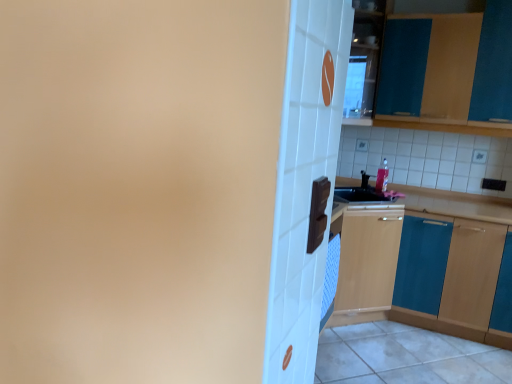
Locate an element on the screen. The image size is (512, 384). teal wood cabinet at right, placed as the first cabinetry when sorted from bottom to top is located at coordinates (420, 272).

Locate an element on the screen. The width and height of the screenshot is (512, 384). teal wood cabinet at upper right, the 2th cabinetry ordered from the bottom is located at coordinates (449, 72).

Which is more to the left, teal wood cabinet at upper right, positioned as the first cabinetry in top-to-bottom order, or white glossy tile at lower right?

Positioned to the left is white glossy tile at lower right.

Does point (490, 81) come closer to viewer compared to point (421, 339)?

Yes, point (490, 81) is in front of point (421, 339).

Where is `cabinetry that is the 1st one when counting rightward from the white glossy tile at lower right`? cabinetry that is the 1st one when counting rightward from the white glossy tile at lower right is located at coordinates (449, 72).

Is white glossy tile at lower right to the left or to the right of teal wood cabinet at right, placed as the first cabinetry when sorted from bottom to top, in the image?

Clearly, white glossy tile at lower right is on the left of teal wood cabinet at right, placed as the first cabinetry when sorted from bottom to top, in the image.

Choose the correct answer: Is white glossy tile at lower right inside teal wood cabinet at right, marked as the 2th cabinetry in a top-to-bottom arrangement, or outside it?

white glossy tile at lower right is spatially situated outside teal wood cabinet at right, marked as the 2th cabinetry in a top-to-bottom arrangement.

Considering the sizes of white glossy tile at lower right and teal wood cabinet at right, marked as the 2th cabinetry in a top-to-bottom arrangement, in the image, is white glossy tile at lower right bigger or smaller than teal wood cabinet at right, marked as the 2th cabinetry in a top-to-bottom arrangement,?

Considering their sizes, white glossy tile at lower right takes up less space than teal wood cabinet at right, marked as the 2th cabinetry in a top-to-bottom arrangement.

Is teal wood cabinet at upper right, the 2th cabinetry ordered from the bottom, further to the viewer compared to teal wood cabinet at right, marked as the 2th cabinetry in a top-to-bottom arrangement?

Yes, it is.

Between teal wood cabinet at upper right, the 2th cabinetry ordered from the bottom, and teal wood cabinet at right, marked as the 2th cabinetry in a top-to-bottom arrangement, which one appears on the left side from the viewer's perspective?

teal wood cabinet at upper right, the 2th cabinetry ordered from the bottom, is more to the left.

Can you confirm if teal wood cabinet at upper right, positioned as the first cabinetry in top-to-bottom order, is thinner than teal wood cabinet at right, placed as the first cabinetry when sorted from bottom to top?

Yes, teal wood cabinet at upper right, positioned as the first cabinetry in top-to-bottom order, is thinner than teal wood cabinet at right, placed as the first cabinetry when sorted from bottom to top.

In terms of height, does white glossy tile at lower right look taller or shorter compared to teal wood cabinet at upper right, the 2th cabinetry ordered from the bottom?

Clearly, white glossy tile at lower right is shorter compared to teal wood cabinet at upper right, the 2th cabinetry ordered from the bottom.

Considering the sizes of objects white glossy tile at lower right and teal wood cabinet at upper right, the 2th cabinetry ordered from the bottom, in the image provided, who is smaller, white glossy tile at lower right or teal wood cabinet at upper right, the 2th cabinetry ordered from the bottom,?

Smaller between the two is white glossy tile at lower right.

Is white glossy tile at lower right at the left side of teal wood cabinet at upper right, positioned as the first cabinetry in top-to-bottom order?

Indeed, white glossy tile at lower right is positioned on the left side of teal wood cabinet at upper right, positioned as the first cabinetry in top-to-bottom order.

Which of these two, teal wood cabinet at right, marked as the 2th cabinetry in a top-to-bottom arrangement, or white glossy tile at lower right, stands shorter?

white glossy tile at lower right.

Which object is positioned more to the right, teal wood cabinet at right, marked as the 2th cabinetry in a top-to-bottom arrangement, or white glossy tile at lower right?

From the viewer's perspective, teal wood cabinet at right, marked as the 2th cabinetry in a top-to-bottom arrangement, appears more on the right side.

Can you confirm if teal wood cabinet at right, placed as the first cabinetry when sorted from bottom to top, is smaller than white glossy tile at lower right?

Incorrect, teal wood cabinet at right, placed as the first cabinetry when sorted from bottom to top, is not smaller in size than white glossy tile at lower right.

You are a GUI agent. You are given a task and a screenshot of the screen. Output one action in this format:
    pyautogui.click(x=<x>, y=<y>)
    Task: Click on the cabinetry on the left of teal wood cabinet at right, marked as the 2th cabinetry in a top-to-bottom arrangement
    The image size is (512, 384).
    Given the screenshot: What is the action you would take?
    pyautogui.click(x=449, y=72)

From the image's perspective, which is above, teal wood cabinet at right, marked as the 2th cabinetry in a top-to-bottom arrangement, or teal wood cabinet at upper right, positioned as the first cabinetry in top-to-bottom order?

From the image's view, teal wood cabinet at upper right, positioned as the first cabinetry in top-to-bottom order, is above.

Is teal wood cabinet at right, marked as the 2th cabinetry in a top-to-bottom arrangement, outside of teal wood cabinet at upper right, positioned as the first cabinetry in top-to-bottom order?

Absolutely, teal wood cabinet at right, marked as the 2th cabinetry in a top-to-bottom arrangement, is external to teal wood cabinet at upper right, positioned as the first cabinetry in top-to-bottom order.

Which is more to the right, teal wood cabinet at right, placed as the first cabinetry when sorted from bottom to top, or teal wood cabinet at upper right, positioned as the first cabinetry in top-to-bottom order?

teal wood cabinet at right, placed as the first cabinetry when sorted from bottom to top, is more to the right.

There is a white glossy tile at lower right. Identify the location of the 2nd cabinetry above it (from a real-world perspective). (449, 72).

From the image's perspective, count 1st cabinetrys upward from the white glossy tile at lower right and point to it. Please provide its 2D coordinates.

[(420, 272)]

Looking at the image, which one is located closer to teal wood cabinet at right, placed as the first cabinetry when sorted from bottom to top, white glossy tile at lower right or teal wood cabinet at upper right, positioned as the first cabinetry in top-to-bottom order?

Based on the image, white glossy tile at lower right appears to be nearer to teal wood cabinet at right, placed as the first cabinetry when sorted from bottom to top.

Which object lies nearer to the anchor point teal wood cabinet at upper right, positioned as the first cabinetry in top-to-bottom order, white glossy tile at lower right or teal wood cabinet at right, marked as the 2th cabinetry in a top-to-bottom arrangement?

teal wood cabinet at right, marked as the 2th cabinetry in a top-to-bottom arrangement, is closer to teal wood cabinet at upper right, positioned as the first cabinetry in top-to-bottom order.

Considering their positions, is teal wood cabinet at upper right, positioned as the first cabinetry in top-to-bottom order, positioned closer to white glossy tile at lower right than teal wood cabinet at right, marked as the 2th cabinetry in a top-to-bottom arrangement?

teal wood cabinet at right, marked as the 2th cabinetry in a top-to-bottom arrangement.

Looking at the image, which one is located closer to white glossy tile at lower right, teal wood cabinet at right, marked as the 2th cabinetry in a top-to-bottom arrangement, or teal wood cabinet at upper right, positioned as the first cabinetry in top-to-bottom order?

teal wood cabinet at right, marked as the 2th cabinetry in a top-to-bottom arrangement, is closer to white glossy tile at lower right.

Based on their spatial positions, is teal wood cabinet at upper right, positioned as the first cabinetry in top-to-bottom order, or white glossy tile at lower right further from teal wood cabinet at right, marked as the 2th cabinetry in a top-to-bottom arrangement?

teal wood cabinet at upper right, positioned as the first cabinetry in top-to-bottom order, lies further to teal wood cabinet at right, marked as the 2th cabinetry in a top-to-bottom arrangement, than the other object.

When comparing their distances from teal wood cabinet at upper right, positioned as the first cabinetry in top-to-bottom order, does teal wood cabinet at right, marked as the 2th cabinetry in a top-to-bottom arrangement, or white glossy tile at lower right seem closer?

The object closer to teal wood cabinet at upper right, positioned as the first cabinetry in top-to-bottom order, is teal wood cabinet at right, marked as the 2th cabinetry in a top-to-bottom arrangement.

Where is `cabinetry between teal wood cabinet at upper right, positioned as the first cabinetry in top-to-bottom order, and white glossy tile at lower right vertically`? cabinetry between teal wood cabinet at upper right, positioned as the first cabinetry in top-to-bottom order, and white glossy tile at lower right vertically is located at coordinates (420, 272).